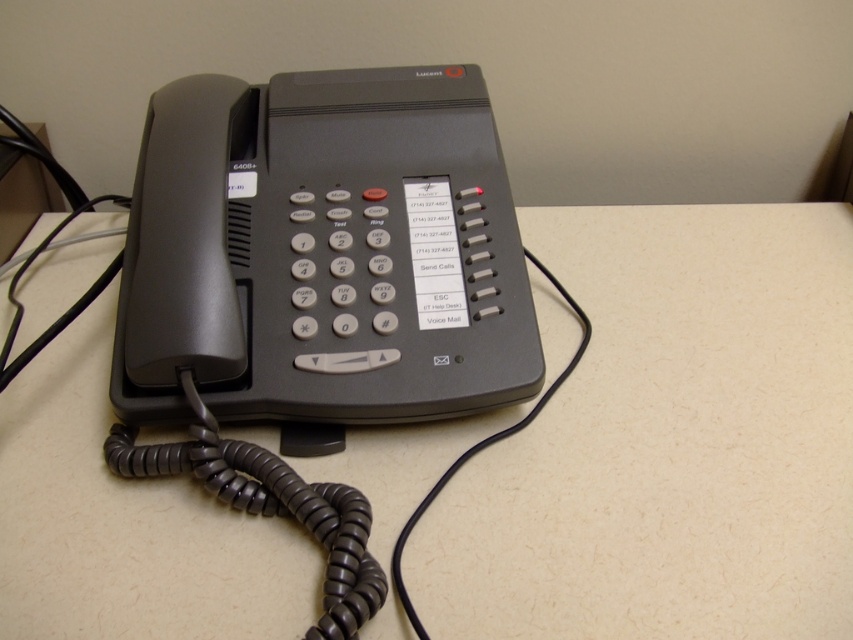
Question: Where is beige matte table at center located in relation to matte black telephone at center in the image?

Choices:
 (A) below
 (B) above

Answer: (A)

Question: Which of the following is the farthest from the observer?

Choices:
 (A) matte black telephone at center
 (B) beige matte table at center

Answer: (A)

Question: Which point appears closest to the camera in this image?

Choices:
 (A) (676, 275)
 (B) (299, 141)

Answer: (B)

Question: Does beige matte table at center appear under matte black telephone at center?

Choices:
 (A) no
 (B) yes

Answer: (B)

Question: Is beige matte table at center positioned behind matte black telephone at center?

Choices:
 (A) yes
 (B) no

Answer: (B)